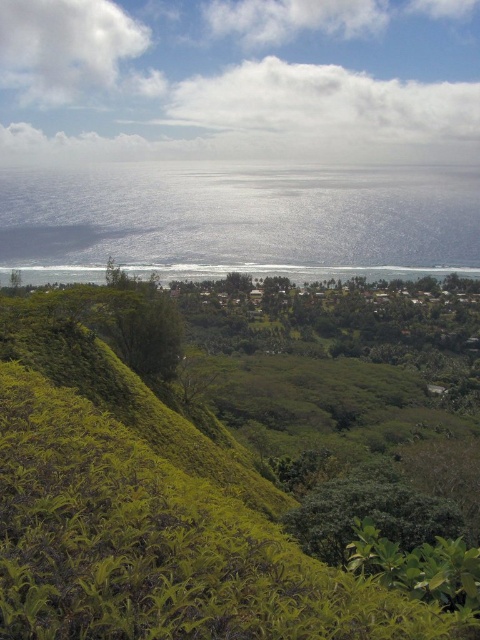
You are standing at the viewpoint overlooking the coastal landscape. You see two points marked on the image. Which point, point [180,464] or point [222,268], is closer to you?

Point [180,464] is closer to the viewer than point [222,268].

You are planning to plant a new garden in your backyard. You have two areas to consider. One is where the green leafy shrubs at lower left currently grow, and the other is near the blue reflective water at center. Which area has a wider space for planting more plants?

The blue reflective water at center has a wider space than the green leafy shrubs at lower left, so you can plant more plants there.

You are planning to plant a new garden in the area shown. Given the space available, which of the two areas would be more suitable for a larger garden bed, the green leafy shrubs at lower left or the blue reflective water at center?

The blue reflective water at center occupies more space than the green leafy shrubs at lower left, so it would be more suitable for a larger garden bed.